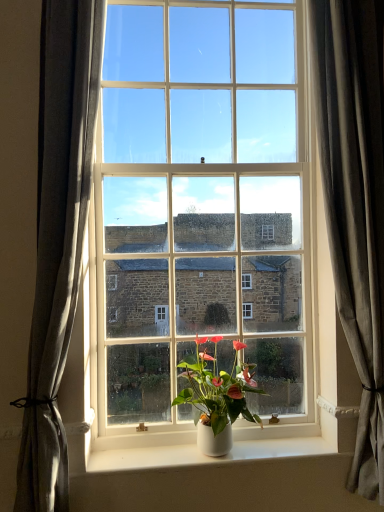
Find the location of a particular element. The height and width of the screenshot is (512, 384). vacant region above white matte window sill at center (from a real-world perspective) is located at coordinates (190, 449).